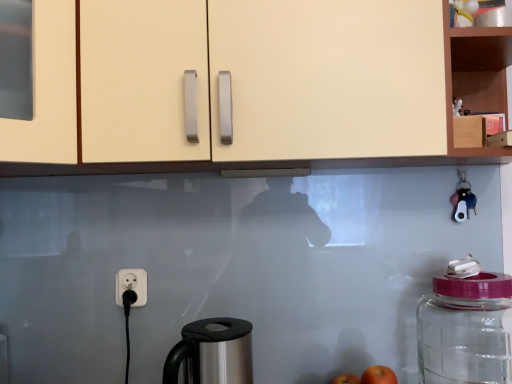
Describe the element at coordinates (378, 375) in the screenshot. I see `red matte apple at lower right, the 2th apple viewed from the back` at that location.

At what (x,y) coordinates should I click in order to perform the action: click on matte cream cabinet at upper center, which appears as the 1th cabinetry when viewed from the left. Please return your answer as a coordinate pair (x, y). This screenshot has height=384, width=512. Looking at the image, I should click on (291, 86).

Where is `red matte apple at lower right, the first apple from the back`? red matte apple at lower right, the first apple from the back is located at coordinates pos(346,379).

Identify the location of red matte apple at lower right, the first apple viewed from the front. (378, 375).

From a real-world perspective, is transparent glass jar at right under red matte apple at lower right, the 1th apple when ordered from top to bottom?

No, from a real-world perspective, transparent glass jar at right is not below red matte apple at lower right, the 1th apple when ordered from top to bottom.

From the picture: Which is more to the right, transparent glass jar at right or red matte apple at lower right, the first apple viewed from the front?

transparent glass jar at right.

Is transparent glass jar at right directly adjacent to red matte apple at lower right, the first apple viewed from the front?

No, transparent glass jar at right is not touching red matte apple at lower right, the first apple viewed from the front.

Could you tell me if transparent glass jar at right is turned towards red matte apple at lower right, the second apple in the bottom-to-top sequence?

No.

Considering the relative positions of matte cream cabinet at upper center, which appears as the 1th cabinetry when viewed from the left, and wooden cabinet at upper right, positioned as the first cabinetry in right-to-left order, in the image provided, is matte cream cabinet at upper center, which appears as the 1th cabinetry when viewed from the left, to the left of wooden cabinet at upper right, positioned as the first cabinetry in right-to-left order, from the viewer's perspective?

Yes.

Consider the image. Which object is wider, matte cream cabinet at upper center, the second cabinetry from the right, or wooden cabinet at upper right, positioned as the first cabinetry in right-to-left order?

With larger width is matte cream cabinet at upper center, the second cabinetry from the right.

Measure the distance from matte cream cabinet at upper center, the second cabinetry from the right, to wooden cabinet at upper right, positioned as the first cabinetry in right-to-left order.

matte cream cabinet at upper center, the second cabinetry from the right, and wooden cabinet at upper right, positioned as the first cabinetry in right-to-left order, are 7.45 inches apart.

From the image's perspective, which one is positioned lower, matte cream cabinet at upper center, which appears as the 1th cabinetry when viewed from the left, or wooden cabinet at upper right, acting as the 2th cabinetry starting from the left?

From the image's view, matte cream cabinet at upper center, which appears as the 1th cabinetry when viewed from the left, is below.

At what (x,y) coordinates should I click in order to perform the action: click on cabinetry located in front of the stainless steel coffee maker at lower center. Please return your answer as a coordinate pair (x, y). Looking at the image, I should click on (291, 86).

Is matte cream cabinet at upper center, which appears as the 1th cabinetry when viewed from the left, far away from stainless steel coffee maker at lower center?

matte cream cabinet at upper center, which appears as the 1th cabinetry when viewed from the left, is near stainless steel coffee maker at lower center, not far away.

Is matte cream cabinet at upper center, which appears as the 1th cabinetry when viewed from the left, not within stainless steel coffee maker at lower center?

That's correct, matte cream cabinet at upper center, which appears as the 1th cabinetry when viewed from the left, is outside of stainless steel coffee maker at lower center.

Does matte cream cabinet at upper center, the second cabinetry from the right, turn towards stainless steel coffee maker at lower center?

No, matte cream cabinet at upper center, the second cabinetry from the right, is not facing towards stainless steel coffee maker at lower center.

Which of these two, wooden cabinet at upper right, acting as the 2th cabinetry starting from the left, or stainless steel coffee maker at lower center, is smaller?

With smaller size is stainless steel coffee maker at lower center.

Choose the correct answer: Is wooden cabinet at upper right, positioned as the first cabinetry in right-to-left order, inside stainless steel coffee maker at lower center or outside it?

A: wooden cabinet at upper right, positioned as the first cabinetry in right-to-left order, is outside stainless steel coffee maker at lower center.

How many degrees apart are the facing directions of wooden cabinet at upper right, acting as the 2th cabinetry starting from the left, and stainless steel coffee maker at lower center?

They differ by 38.3 degrees in their facing directions.

The height and width of the screenshot is (384, 512). What are the coordinates of `coffee maker located underneath the wooden cabinet at upper right, positioned as the first cabinetry in right-to-left order (from a real-world perspective)` in the screenshot? It's located at (212, 352).

Does point (358, 383) appear closer or farther from the camera than point (377, 158)?

Point (358, 383) is farther from the camera than point (377, 158).

Can you confirm if red matte apple at lower right, which is counted as the 2th apple, starting from the top, is taller than matte cream cabinet at upper center, which appears as the 1th cabinetry when viewed from the left?

Incorrect, the height of red matte apple at lower right, which is counted as the 2th apple, starting from the top, is not larger of that of matte cream cabinet at upper center, which appears as the 1th cabinetry when viewed from the left.

Which of these two, red matte apple at lower right, which is counted as the 2th apple, starting from the top, or matte cream cabinet at upper center, the second cabinetry from the right, is smaller?

With smaller size is red matte apple at lower right, which is counted as the 2th apple, starting from the top.

Based on the photo, from the image's perspective, would you say stainless steel coffee maker at lower center is shown under transparent glass jar at right?

Indeed, from the image's perspective, stainless steel coffee maker at lower center is shown beneath transparent glass jar at right.

Is stainless steel coffee maker at lower center taller than transparent glass jar at right?

In fact, stainless steel coffee maker at lower center may be shorter than transparent glass jar at right.

Is stainless steel coffee maker at lower center wider than transparent glass jar at right?

Incorrect, the width of stainless steel coffee maker at lower center does not surpass that of transparent glass jar at right.

Locate an element on the screen. The image size is (512, 384). bottle behind the matte cream cabinet at upper center, the second cabinetry from the right is located at coordinates (466, 330).

Is matte cream cabinet at upper center, which appears as the 1th cabinetry when viewed from the left, aimed at transparent glass jar at right?

No, matte cream cabinet at upper center, which appears as the 1th cabinetry when viewed from the left, is not facing towards transparent glass jar at right.

In the scene shown: From a real-world perspective, is matte cream cabinet at upper center, the second cabinetry from the right, below transparent glass jar at right?

No, from a real-world perspective, matte cream cabinet at upper center, the second cabinetry from the right, is not beneath transparent glass jar at right.

From the image's perspective, relative to transparent glass jar at right, is matte cream cabinet at upper center, the second cabinetry from the right, above or below?

From the image's perspective, matte cream cabinet at upper center, the second cabinetry from the right, appears above transparent glass jar at right.

The image size is (512, 384). I want to click on apple that is the 1st object directly below the transparent glass jar at right (from a real-world perspective), so click(x=378, y=375).

In order to click on cabinetry that appears on the left of wooden cabinet at upper right, positioned as the first cabinetry in right-to-left order in this screenshot , I will do `click(291, 86)`.

Estimate the real-world distances between objects in this image. Which object is closer to stainless steel coffee maker at lower center, red matte apple at lower right, which is the 1th apple from bottom to top, or matte cream cabinet at upper center, the second cabinetry from the right?

The object closer to stainless steel coffee maker at lower center is red matte apple at lower right, which is the 1th apple from bottom to top.

From the image, which object appears to be farther from wooden cabinet at upper right, acting as the 2th cabinetry starting from the left, red matte apple at lower right, the 1th apple when ordered from top to bottom, or transparent glass jar at right?

red matte apple at lower right, the 1th apple when ordered from top to bottom, lies further to wooden cabinet at upper right, acting as the 2th cabinetry starting from the left, than the other object.

In the scene shown: Estimate the real-world distances between objects in this image. Which object is further from red matte apple at lower right, the 2th apple viewed from the back, matte cream cabinet at upper center, the second cabinetry from the right, or transparent glass jar at right?

matte cream cabinet at upper center, the second cabinetry from the right, lies further to red matte apple at lower right, the 2th apple viewed from the back, than the other object.

Considering their positions, is red matte apple at lower right, the first apple from the back, positioned further to stainless steel coffee maker at lower center than transparent glass jar at right?

transparent glass jar at right is further to stainless steel coffee maker at lower center.

When comparing their distances from red matte apple at lower right, the first apple from the back, does transparent glass jar at right or wooden cabinet at upper right, acting as the 2th cabinetry starting from the left, seem closer?

transparent glass jar at right.

Considering their positions, is wooden cabinet at upper right, positioned as the first cabinetry in right-to-left order, positioned closer to stainless steel coffee maker at lower center than red matte apple at lower right, which is counted as the 2th apple, starting from the top?

red matte apple at lower right, which is counted as the 2th apple, starting from the top.

Considering their positions, is stainless steel coffee maker at lower center positioned closer to matte cream cabinet at upper center, the second cabinetry from the right, than transparent glass jar at right?

Among the two, stainless steel coffee maker at lower center is located nearer to matte cream cabinet at upper center, the second cabinetry from the right.

Looking at this image, estimate the real-world distances between objects in this image. Which object is closer to wooden cabinet at upper right, positioned as the first cabinetry in right-to-left order, red matte apple at lower right, the first apple from the back, or transparent glass jar at right?

transparent glass jar at right.

Where is `cabinetry between wooden cabinet at upper right, positioned as the first cabinetry in right-to-left order, and red matte apple at lower right, which is counted as the 2th apple, starting from the top, in the vertical direction`? Image resolution: width=512 pixels, height=384 pixels. cabinetry between wooden cabinet at upper right, positioned as the first cabinetry in right-to-left order, and red matte apple at lower right, which is counted as the 2th apple, starting from the top, in the vertical direction is located at coordinates [x=291, y=86].

At what (x,y) coordinates should I click in order to perform the action: click on apple between wooden cabinet at upper right, acting as the 2th cabinetry starting from the left, and red matte apple at lower right, which is the 1th apple from bottom to top, vertically. Please return your answer as a coordinate pair (x, y). This screenshot has width=512, height=384. Looking at the image, I should click on (378, 375).

Find the location of `bottle between wooden cabinet at upper right, positioned as the first cabinetry in right-to-left order, and red matte apple at lower right, the 2th apple viewed from the back, from top to bottom`. bottle between wooden cabinet at upper right, positioned as the first cabinetry in right-to-left order, and red matte apple at lower right, the 2th apple viewed from the back, from top to bottom is located at coordinates (466, 330).

At what (x,y) coordinates should I click in order to perform the action: click on coffee maker between matte cream cabinet at upper center, which appears as the 1th cabinetry when viewed from the left, and red matte apple at lower right, the 2th apple viewed from the back, from top to bottom. Please return your answer as a coordinate pair (x, y). Image resolution: width=512 pixels, height=384 pixels. Looking at the image, I should click on (212, 352).